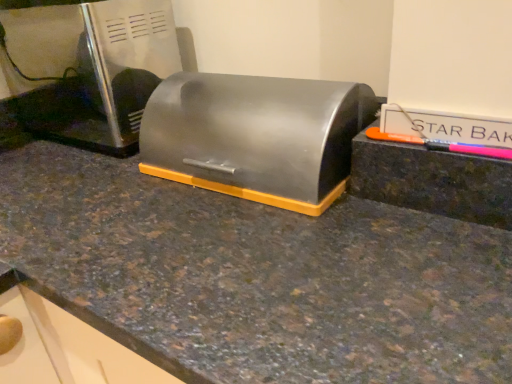
Question: Is satin silver breadbox at center smaller than satin silver toaster at upper left?

Choices:
 (A) no
 (B) yes

Answer: (B)

Question: Considering the relative sizes of satin silver breadbox at center and satin silver toaster at upper left in the image provided, is satin silver breadbox at center wider than satin silver toaster at upper left?

Choices:
 (A) yes
 (B) no

Answer: (B)

Question: Does satin silver breadbox at center have a greater height compared to satin silver toaster at upper left?

Choices:
 (A) no
 (B) yes

Answer: (A)

Question: Does satin silver breadbox at center have a lesser height compared to satin silver toaster at upper left?

Choices:
 (A) no
 (B) yes

Answer: (B)

Question: From a real-world perspective, is satin silver breadbox at center below satin silver toaster at upper left?

Choices:
 (A) yes
 (B) no

Answer: (A)

Question: Can you confirm if satin silver breadbox at center is thinner than satin silver toaster at upper left?

Choices:
 (A) yes
 (B) no

Answer: (A)

Question: Does satin silver toaster at upper left have a larger size compared to satin silver breadbox at center?

Choices:
 (A) no
 (B) yes

Answer: (B)

Question: Considering the relative sizes of satin silver toaster at upper left and satin silver breadbox at center in the image provided, is satin silver toaster at upper left thinner than satin silver breadbox at center?

Choices:
 (A) yes
 (B) no

Answer: (B)

Question: Does satin silver toaster at upper left come behind satin silver breadbox at center?

Choices:
 (A) no
 (B) yes

Answer: (B)

Question: Considering the relative sizes of satin silver toaster at upper left and satin silver breadbox at center in the image provided, is satin silver toaster at upper left wider than satin silver breadbox at center?

Choices:
 (A) no
 (B) yes

Answer: (B)

Question: Does satin silver toaster at upper left appear on the left side of satin silver breadbox at center?

Choices:
 (A) no
 (B) yes

Answer: (B)

Question: Can you confirm if satin silver toaster at upper left is positioned to the right of satin silver breadbox at center?

Choices:
 (A) yes
 (B) no

Answer: (B)

Question: In the image, is satin silver breadbox at center on the left side or the right side of satin silver toaster at upper left?

Choices:
 (A) left
 (B) right

Answer: (B)